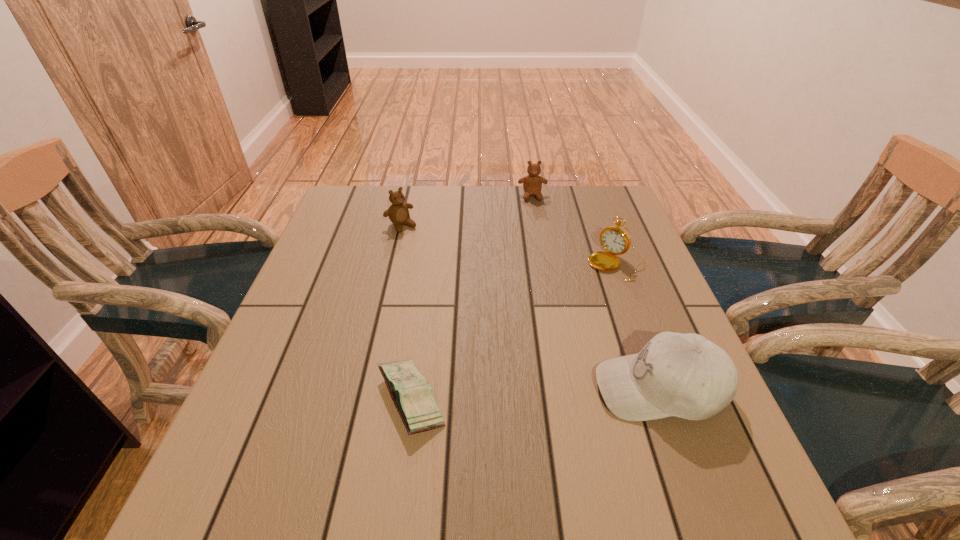
Where is `vacant area between the third nearest object and the nearer teddy bear`? vacant area between the third nearest object and the nearer teddy bear is located at coordinates (509, 245).

Find the location of a particular element. free point between the baseball cap and the third object from right to left is located at coordinates (596, 292).

Identify which object is the second nearest to the right teddy bear. Please provide its 2D coordinates. Your answer should be formatted as a tuple, i.e. [(x, y)], where the tuple contains the x and y coordinates of a point satisfying the conditions above.

[(398, 212)]

The width and height of the screenshot is (960, 540). In order to click on the fourth closest object to the right teddy bear in this screenshot , I will do `click(413, 397)`.

Where is `vacant position in the image that satisfies the following two spatial constraints: 1. on the front side of the baseball cap; 2. on the front-facing side of the farther teddy bear`? vacant position in the image that satisfies the following two spatial constraints: 1. on the front side of the baseball cap; 2. on the front-facing side of the farther teddy bear is located at coordinates (565, 388).

In order to click on vacant region that satisfies the following two spatial constraints: 1. on the back side of the diary; 2. on the front-facing side of the baseball cap in this screenshot , I will do `click(413, 388)`.

Find the location of a particular element. free space that satisfies the following two spatial constraints: 1. on the front side of the nearer teddy bear; 2. on the front-facing side of the baseball cap is located at coordinates point(363,388).

Where is `vacant space that satisfies the following two spatial constraints: 1. on the back side of the baseball cap; 2. on the front-facing side of the diary`? vacant space that satisfies the following two spatial constraints: 1. on the back side of the baseball cap; 2. on the front-facing side of the diary is located at coordinates (413, 388).

This screenshot has height=540, width=960. I want to click on free space that satisfies the following two spatial constraints: 1. on the front side of the pocket watch; 2. on the left side of the fourth nearest object, so click(392, 264).